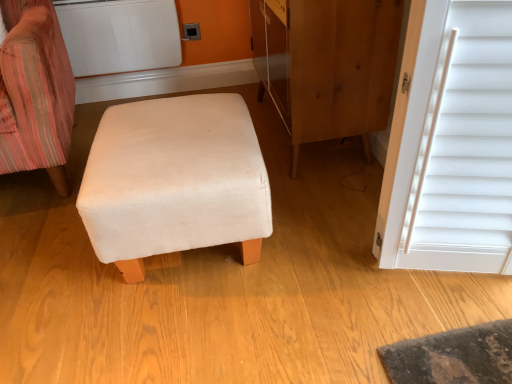
Question: Considering the relative sizes of white matte radiator at upper left and beige fabric ottoman at center in the image provided, is white matte radiator at upper left shorter than beige fabric ottoman at center?

Choices:
 (A) yes
 (B) no

Answer: (A)

Question: From the image's perspective, is white matte radiator at upper left located beneath beige fabric ottoman at center?

Choices:
 (A) no
 (B) yes

Answer: (A)

Question: Would you say beige fabric ottoman at center is part of white matte radiator at upper left's contents?

Choices:
 (A) yes
 (B) no

Answer: (B)

Question: Is white matte radiator at upper left located outside beige fabric ottoman at center?

Choices:
 (A) no
 (B) yes

Answer: (B)

Question: From the image's perspective, is white matte radiator at upper left over beige fabric ottoman at center?

Choices:
 (A) yes
 (B) no

Answer: (A)

Question: Is white matte radiator at upper left positioned before beige fabric ottoman at center?

Choices:
 (A) no
 (B) yes

Answer: (A)

Question: Is white matte radiator at upper left further to camera compared to matte plastic outlet at upper center?

Choices:
 (A) no
 (B) yes

Answer: (A)

Question: Is there a large distance between white matte radiator at upper left and matte plastic outlet at upper center?

Choices:
 (A) yes
 (B) no

Answer: (B)

Question: Does white matte radiator at upper left have a smaller size compared to matte plastic outlet at upper center?

Choices:
 (A) no
 (B) yes

Answer: (A)

Question: Is white matte radiator at upper left looking in the opposite direction of matte plastic outlet at upper center?

Choices:
 (A) no
 (B) yes

Answer: (A)

Question: Is white matte radiator at upper left positioned beyond the bounds of matte plastic outlet at upper center?

Choices:
 (A) no
 (B) yes

Answer: (B)

Question: From the image's perspective, is white matte radiator at upper left over matte plastic outlet at upper center?

Choices:
 (A) yes
 (B) no

Answer: (B)

Question: Considering the relative sizes of velvet striped chair at left and wooden dresser at center in the image provided, is velvet striped chair at left smaller than wooden dresser at center?

Choices:
 (A) no
 (B) yes

Answer: (A)